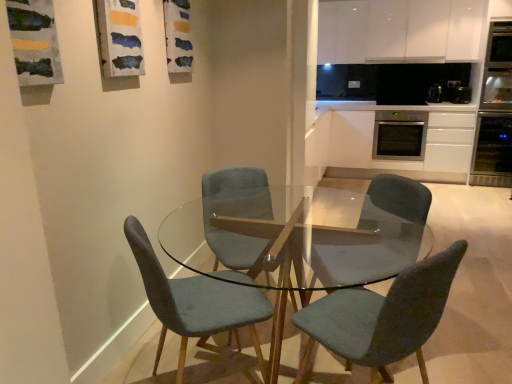
Consider the image. What is the approximate width of white matte cabinet at upper center, which is counted as the 1th cabinetry, starting from the top?

white matte cabinet at upper center, which is counted as the 1th cabinetry, starting from the top, is 14.66 inches in width.

The image size is (512, 384). Describe the element at coordinates (435, 93) in the screenshot. I see `satin black oven at right, placed as the 3th appliance when sorted from right to left` at that location.

Where is `stainless steel oven at right, marked as the first appliance in a right-to-left arrangement`? stainless steel oven at right, marked as the first appliance in a right-to-left arrangement is located at coordinates (495, 112).

Where is `satin black oven at right`? This screenshot has height=384, width=512. satin black oven at right is located at coordinates (492, 150).

What do you see at coordinates (383, 316) in the screenshot?
I see `velvet teal chair at center, the third chair when ordered from left to right` at bounding box center [383, 316].

Measure the distance between point (445,299) and camera.

The depth of point (445,299) is 1.45 meters.

Where is `velvet teal chair at center, which ranks as the third chair in right-to-left order`? velvet teal chair at center, which ranks as the third chair in right-to-left order is located at coordinates (195, 302).

Is stainless steel oven at right, marked as the first appliance in a right-to-left arrangement, bigger or smaller than satin white cabinet at right, acting as the 2th cabinetry starting from the top?

In the image, stainless steel oven at right, marked as the first appliance in a right-to-left arrangement, appears to be smaller than satin white cabinet at right, acting as the 2th cabinetry starting from the top.

Can you confirm if stainless steel oven at right, positioned as the third appliance in left-to-right order, is taller than satin white cabinet at right, acting as the first cabinetry starting from the bottom?

Correct, stainless steel oven at right, positioned as the third appliance in left-to-right order, is much taller as satin white cabinet at right, acting as the first cabinetry starting from the bottom.

Is stainless steel oven at right, positioned as the third appliance in left-to-right order, situated inside satin white cabinet at right, acting as the 2th cabinetry starting from the top, or outside?

The correct answer is: outside.

Could you tell me if stainless steel oven at right, marked as the first appliance in a right-to-left arrangement, is turned towards satin white cabinet at right, acting as the first cabinetry starting from the bottom?

No, stainless steel oven at right, marked as the first appliance in a right-to-left arrangement, is not facing towards satin white cabinet at right, acting as the first cabinetry starting from the bottom.

Are black plastic toaster at upper right, acting as the 2th appliance starting from the left, and satin black oven at right, placed as the 3th appliance when sorted from right to left, making contact?

No, black plastic toaster at upper right, acting as the 2th appliance starting from the left, is not in contact with satin black oven at right, placed as the 3th appliance when sorted from right to left.

Which of these two, black plastic toaster at upper right, which ranks as the second appliance in right-to-left order, or satin black oven at right, placed as the 3th appliance when sorted from right to left, is wider?

Wider between the two is black plastic toaster at upper right, which ranks as the second appliance in right-to-left order.

Considering the relative positions of black plastic toaster at upper right, which ranks as the second appliance in right-to-left order, and satin black oven at right, which is the 1th appliance from left to right, in the image provided, is black plastic toaster at upper right, which ranks as the second appliance in right-to-left order, to the left of satin black oven at right, which is the 1th appliance from left to right, from the viewer's perspective?

No, black plastic toaster at upper right, which ranks as the second appliance in right-to-left order, is not to the left of satin black oven at right, which is the 1th appliance from left to right.

At what (x,y) coordinates should I click in order to perform the action: click on appliance on the left of black plastic toaster at upper right, acting as the 2th appliance starting from the left. Please return your answer as a coordinate pair (x, y). The image size is (512, 384). Looking at the image, I should click on (435, 93).

Between point (375, 119) and point (441, 100), which one is positioned behind?

The point (375, 119) is farther.

Is stainless steel oven at center-right inside the boundaries of satin black oven at right, which is the 1th appliance from left to right, or outside?

Result: The correct answer is: outside.

From a real-world perspective, is stainless steel oven at center-right over satin black oven at right, placed as the 3th appliance when sorted from right to left?

Incorrect, from a real-world perspective, stainless steel oven at center-right is lower than satin black oven at right, placed as the 3th appliance when sorted from right to left.

Can you confirm if satin white cabinet at right, acting as the 2th cabinetry starting from the top, is smaller than velvet teal chair at center, the first chair when ordered from left to right?

No.

Does satin white cabinet at right, acting as the 2th cabinetry starting from the top, have a greater height compared to velvet teal chair at center, the first chair when ordered from left to right?

Correct, satin white cabinet at right, acting as the 2th cabinetry starting from the top, is much taller as velvet teal chair at center, the first chair when ordered from left to right.

Is point (461, 156) positioned after point (176, 321)?

That is True.

Find the location of a particular element. This screenshot has height=384, width=512. the 1st cabinetry positioned above the velvet teal chair at center, which ranks as the third chair in right-to-left order (from a real-world perspective) is located at coordinates (399, 160).

In the scene shown: Can you tell me how much transparent glass table at center and velvet teal chair at center, placed as the 2th chair when sorted from left to right, differ in facing direction?

The angle between the facing direction of transparent glass table at center and the facing direction of velvet teal chair at center, placed as the 2th chair when sorted from left to right, is 52.8 degrees.

Is transparent glass table at center positioned with its back to velvet teal chair at center, placed as the 2th chair when sorted from left to right?

Yes, transparent glass table at center is facing away from velvet teal chair at center, placed as the 2th chair when sorted from left to right.

From the image's perspective, is transparent glass table at center located above or below velvet teal chair at center, the second chair positioned from the right?

From the image's perspective, transparent glass table at center appears below velvet teal chair at center, the second chair positioned from the right.

Find the location of a particular element. coffee table below the velvet teal chair at center, the second chair positioned from the right (from a real-world perspective) is located at coordinates [298, 240].

From a real-world perspective, is satin black oven at right, which is the 1th appliance from left to right, located higher than velvet teal chair at center, the second chair positioned from the right?

Correct, in the physical world, satin black oven at right, which is the 1th appliance from left to right, is higher than velvet teal chair at center, the second chair positioned from the right.

Is satin black oven at right, placed as the 3th appliance when sorted from right to left, oriented towards velvet teal chair at center, the second chair positioned from the right?

Yes, satin black oven at right, placed as the 3th appliance when sorted from right to left, is aimed at velvet teal chair at center, the second chair positioned from the right.

Considering the relative sizes of satin black oven at right, which is the 1th appliance from left to right, and velvet teal chair at center, the second chair positioned from the right, in the image provided, is satin black oven at right, which is the 1th appliance from left to right, smaller than velvet teal chair at center, the second chair positioned from the right,?

Indeed, satin black oven at right, which is the 1th appliance from left to right, has a smaller size compared to velvet teal chair at center, the second chair positioned from the right.

Is point (435, 83) closer to camera compared to point (208, 193)?

That is False.

From the image's perspective, between stainless steel oven at center-right and black plastic toaster at upper right, which ranks as the second appliance in right-to-left order, who is located below?

stainless steel oven at center-right appears lower in the image.

Between stainless steel oven at center-right and black plastic toaster at upper right, which ranks as the second appliance in right-to-left order, which one has more height?

stainless steel oven at center-right is taller.

Considering the sizes of objects stainless steel oven at center-right and black plastic toaster at upper right, which ranks as the second appliance in right-to-left order, in the image provided, who is wider, stainless steel oven at center-right or black plastic toaster at upper right, which ranks as the second appliance in right-to-left order,?

Wider between the two is stainless steel oven at center-right.

Considering the relative sizes of stainless steel oven at center-right and black plastic toaster at upper right, acting as the 2th appliance starting from the left, in the image provided, is stainless steel oven at center-right smaller than black plastic toaster at upper right, acting as the 2th appliance starting from the left,?

Actually, stainless steel oven at center-right might be larger than black plastic toaster at upper right, acting as the 2th appliance starting from the left.

You are a GUI agent. You are given a task and a screenshot of the screen. Output one action in this format:
    pyautogui.click(x=<x>, y=<y>)
    Task: Click on the cabinetry that appears below the stainless steel oven at right, positioned as the third appliance in left-to-right order (from a real-world perspective)
    Image resolution: width=512 pixels, height=384 pixels.
    Given the screenshot: What is the action you would take?
    pyautogui.click(x=399, y=160)

What are the coordinates of `appliance behind the black plastic toaster at upper right, which ranks as the second appliance in right-to-left order` in the screenshot? It's located at (435, 93).

From the image, which object appears to be nearer to black plastic toaster at upper right, which ranks as the second appliance in right-to-left order, satin black oven at right or stainless steel oven at right, marked as the first appliance in a right-to-left arrangement?

stainless steel oven at right, marked as the first appliance in a right-to-left arrangement.

Considering their positions, is satin black oven at right positioned further to stainless steel oven at center-right than velvet teal chair at center, the first chair when ordered from left to right?

velvet teal chair at center, the first chair when ordered from left to right, is positioned further to the anchor stainless steel oven at center-right.

From the image, which object appears to be farther from velvet teal chair at center, the first chair viewed from the right, satin white cabinet at right, acting as the 2th cabinetry starting from the top, or satin black oven at right, placed as the 3th appliance when sorted from right to left?

satin black oven at right, placed as the 3th appliance when sorted from right to left.

Which object lies nearer to the anchor point stainless steel oven at center-right, velvet teal chair at center, the first chair when ordered from left to right, or satin black oven at right?

satin black oven at right lies closer to stainless steel oven at center-right than the other object.

Looking at the image, which one is located closer to stainless steel oven at center-right, white matte cabinet at upper center, which is counted as the 1th cabinetry, starting from the top, or black plastic toaster at upper right, which ranks as the second appliance in right-to-left order?

black plastic toaster at upper right, which ranks as the second appliance in right-to-left order, is closer to stainless steel oven at center-right.

Estimate the real-world distances between objects in this image. Which object is closer to velvet teal chair at center, the first chair when ordered from left to right, satin black oven at right or white matte cabinet at upper center, which is counted as the second cabinetry, starting from the bottom?

white matte cabinet at upper center, which is counted as the second cabinetry, starting from the bottom, is positioned closer to the anchor velvet teal chair at center, the first chair when ordered from left to right.

Looking at this image, which object lies nearer to the anchor point velvet teal chair at center, the third chair when ordered from left to right, satin white cabinet at right, acting as the 2th cabinetry starting from the top, or black plastic toaster at upper right, acting as the 2th appliance starting from the left?

satin white cabinet at right, acting as the 2th cabinetry starting from the top.

From the image, which object appears to be nearer to stainless steel oven at center-right, satin white cabinet at right, acting as the 2th cabinetry starting from the top, or transparent glass table at center?

Among the two, satin white cabinet at right, acting as the 2th cabinetry starting from the top, is located nearer to stainless steel oven at center-right.

Locate an element on the screen. coffee table between velvet teal chair at center, the third chair when ordered from left to right, and velvet teal chair at center, placed as the 2th chair when sorted from left to right, along the z-axis is located at coordinates (298, 240).

What are the coordinates of `oven located between velvet teal chair at center, the second chair positioned from the right, and white matte cabinet at upper center, which is counted as the 1th cabinetry, starting from the top, in the depth direction` in the screenshot? It's located at (492, 150).

The image size is (512, 384). In order to click on chair positioned between transparent glass table at center and velvet teal chair at center, the second chair positioned from the right, from near to far in this screenshot , I will do `click(195, 302)`.

Find the location of a particular element. Image resolution: width=512 pixels, height=384 pixels. appliance between velvet teal chair at center, placed as the 2th chair when sorted from left to right, and satin white cabinet at right, acting as the 2th cabinetry starting from the top, along the z-axis is located at coordinates (495, 112).